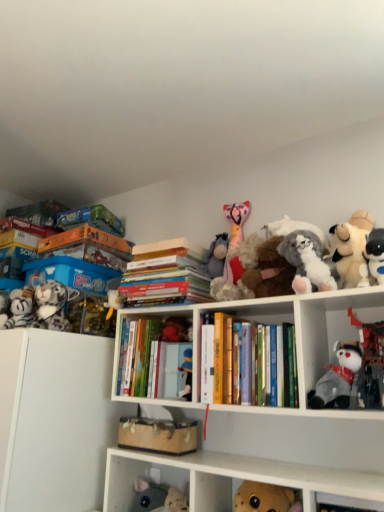
Locate an element on the screen. fuzzy fabric stuffed animal at lower left, the 1th cabinet from the bottom is located at coordinates (138, 476).

What do you see at coordinates (54, 420) in the screenshot? This screenshot has width=384, height=512. I see `white matte cabinet at left` at bounding box center [54, 420].

Describe the element at coordinates (267, 326) in the screenshot. I see `white matte bookshelf at upper center, placed as the 2th cabinet when sorted from bottom to top` at that location.

The width and height of the screenshot is (384, 512). What do you see at coordinates (373, 259) in the screenshot? I see `white plush toy at upper right, which ranks as the 9th toy in left-to-right order` at bounding box center [373, 259].

The width and height of the screenshot is (384, 512). Find the location of `hardcover books at center, the 1th book positioned from the right`. hardcover books at center, the 1th book positioned from the right is located at coordinates (249, 362).

Image resolution: width=384 pixels, height=512 pixels. Find the location of `striped plush tiger at left, which appears as the tenth toy when viewed from the right`. striped plush tiger at left, which appears as the tenth toy when viewed from the right is located at coordinates (19, 309).

From the image's perspective, which is above, gray plush toy at center-right, placed as the fourth toy when sorted from right to left, or white plush toy at upper right, which is the 2th toy in right-to-left order?

From the image's view, white plush toy at upper right, which is the 2th toy in right-to-left order, is above.

Starting from the white plush toy at upper right, which ranks as the 9th toy in left-to-right order, which toy is the 2nd one to the left? Please provide its 2D coordinates.

[(337, 378)]

Is gray plush toy at center-right, placed as the fourth toy when sorted from right to left, taller than white plush toy at upper right, which is the 2th toy in right-to-left order?

Yes, gray plush toy at center-right, placed as the fourth toy when sorted from right to left, is taller than white plush toy at upper right, which is the 2th toy in right-to-left order.

Considering the positions of point (361, 279) and point (315, 257), is point (361, 279) closer or farther from the camera than point (315, 257)?

Point (361, 279).

Between white plush toy at upper right, which is the 2th toy in right-to-left order, and fluffy white plush at upper right, the 6th toy in the left-to-right sequence, which one appears on the left side from the viewer's perspective?

From the viewer's perspective, fluffy white plush at upper right, the 6th toy in the left-to-right sequence, appears more on the left side.

From the image's perspective, is white plush toy at upper right, which is the 2th toy in right-to-left order, located beneath fluffy white plush at upper right, placed as the 5th toy when sorted from right to left?

No, from the image's perspective, white plush toy at upper right, which is the 2th toy in right-to-left order, is not beneath fluffy white plush at upper right, placed as the 5th toy when sorted from right to left.

Is white plush toy at upper right, which is the 2th toy in right-to-left order, positioned beyond the bounds of fluffy white plush at upper right, placed as the 5th toy when sorted from right to left?

Absolutely, white plush toy at upper right, which is the 2th toy in right-to-left order, is external to fluffy white plush at upper right, placed as the 5th toy when sorted from right to left.

Is white matte bookshelf at upper center, placed as the 2th cabinet when sorted from bottom to top, shorter than hardcover books at center, the 3th book positioned from the left?

No, white matte bookshelf at upper center, placed as the 2th cabinet when sorted from bottom to top, is not shorter than hardcover books at center, the 3th book positioned from the left.

In the scene shown: Can you confirm if white matte bookshelf at upper center, placed as the 2th cabinet when sorted from bottom to top, is thinner than hardcover books at center, the 1th book positioned from the right?

No, white matte bookshelf at upper center, placed as the 2th cabinet when sorted from bottom to top, is not thinner than hardcover books at center, the 1th book positioned from the right.

From a real-world perspective, relative to hardcover books at center, the 1th book positioned from the right, is white matte bookshelf at upper center, placed as the 2th cabinet when sorted from bottom to top, vertically above or below?

From a real-world perspective, white matte bookshelf at upper center, placed as the 2th cabinet when sorted from bottom to top, is physically above hardcover books at center, the 1th book positioned from the right.

Is white matte bookshelf at upper center, the 1th cabinet positioned from the top, outside of hardcover books at center, the 1th book positioned from the right?

white matte bookshelf at upper center, the 1th cabinet positioned from the top, is positioned outside hardcover books at center, the 1th book positioned from the right.

Is point (360, 230) positioned before point (137, 331)?

Yes.

Does fluffy white stuffed animal at upper right, which is the 3th toy from right to left, contain white matte bookshelf at upper center, the 1th cabinet positioned from the top?

No, white matte bookshelf at upper center, the 1th cabinet positioned from the top, is not a part of fluffy white stuffed animal at upper right, which is the 3th toy from right to left.

Considering their positions, is fluffy white stuffed animal at upper right, which ranks as the eighth toy in left-to-right order, located in front of or behind white matte bookshelf at upper center, the 1th cabinet positioned from the top?

fluffy white stuffed animal at upper right, which ranks as the eighth toy in left-to-right order, is positioned farther from the viewer than white matte bookshelf at upper center, the 1th cabinet positioned from the top.

Is fluffy white stuffed animal at upper right, which is the 3th toy from right to left, next to white matte bookshelf at upper center, placed as the 2th cabinet when sorted from bottom to top, and touching it?

No, fluffy white stuffed animal at upper right, which is the 3th toy from right to left, is not making contact with white matte bookshelf at upper center, placed as the 2th cabinet when sorted from bottom to top.

From a real-world perspective, relative to hardcover books at center, placed as the first book when sorted from left to right, is velvet plush bear at center, which ranks as the third toy in left-to-right order, vertically above or below?

velvet plush bear at center, which ranks as the third toy in left-to-right order, is above hardcover books at center, placed as the first book when sorted from left to right.

Is velvet plush bear at center, the 8th toy positioned from the right, further to camera compared to hardcover books at center, placed as the first book when sorted from left to right?

Yes, velvet plush bear at center, the 8th toy positioned from the right, is further from the camera.

Does velvet plush bear at center, which ranks as the third toy in left-to-right order, have a greater height compared to hardcover books at center, placed as the first book when sorted from left to right?

No.

Are velvet plush bear at center, which ranks as the third toy in left-to-right order, and hardcover books at center, placed as the first book when sorted from left to right, beside each other?

Yes, velvet plush bear at center, which ranks as the third toy in left-to-right order, is with hardcover books at center, placed as the first book when sorted from left to right.

From the image's perspective, which is below, fluffy white plush at upper right, the 6th toy in the left-to-right sequence, or fluffy pink plush at upper center, marked as the fifth toy in a left-to-right arrangement?

From the image's view, fluffy white plush at upper right, the 6th toy in the left-to-right sequence, is below.

Which of these two, fluffy white plush at upper right, the 6th toy in the left-to-right sequence, or fluffy pink plush at upper center, which appears as the sixth toy when viewed from the right, is smaller?

Smaller between the two is fluffy pink plush at upper center, which appears as the sixth toy when viewed from the right.

Locate an element on the screen. The width and height of the screenshot is (384, 512). the 4th toy in front of the fluffy pink plush at upper center, marked as the fifth toy in a left-to-right arrangement, starting your count from the anchor is located at coordinates (308, 262).

Can you confirm if fluffy white plush at upper right, the 6th toy in the left-to-right sequence, is thinner than fluffy pink plush at upper center, marked as the fifth toy in a left-to-right arrangement?

Incorrect, the width of fluffy white plush at upper right, the 6th toy in the left-to-right sequence, is not less than that of fluffy pink plush at upper center, marked as the fifth toy in a left-to-right arrangement.

Which of these two, velvet plush bear at center, which ranks as the third toy in left-to-right order, or matte plastic toy at center, marked as the 4th toy in a left-to-right arrangement, is bigger?

With larger size is velvet plush bear at center, which ranks as the third toy in left-to-right order.

Which of these two, velvet plush bear at center, the 8th toy positioned from the right, or matte plastic toy at center, marked as the 4th toy in a left-to-right arrangement, stands shorter?

velvet plush bear at center, the 8th toy positioned from the right, is shorter.

Consider the image. Considering the sizes of velvet plush bear at center, the 8th toy positioned from the right, and matte plastic toy at center, the 7th toy when ordered from right to left, in the image, is velvet plush bear at center, the 8th toy positioned from the right, wider or thinner than matte plastic toy at center, the 7th toy when ordered from right to left,?

In the image, velvet plush bear at center, the 8th toy positioned from the right, appears to be wider than matte plastic toy at center, the 7th toy when ordered from right to left.

Locate an element on the screen. The height and width of the screenshot is (512, 384). the 6th toy above the gray plush toy at center-right, which is the seventh toy from left to right (from the image's perspective) is located at coordinates (373, 259).

From the fluffy white plush at upper right, the 6th toy in the left-to-right sequence, count 2nd toys forward and point to it. Please provide its 2D coordinates.

[(373, 259)]

Which object lies further to the anchor point fluffy white stuffed animal at upper right, which ranks as the eighth toy in left-to-right order, white matte cabinet at left or fluffy gray plush at left, placed as the 9th toy when sorted from right to left?

The object further to fluffy white stuffed animal at upper right, which ranks as the eighth toy in left-to-right order, is white matte cabinet at left.

When comparing their distances from white plush toy at right, the first toy when ordered from right to left, does hardcover books at center, the 1th book positioned from the right, or velvet plush bear at center, the 8th toy positioned from the right, seem further?

Based on the image, velvet plush bear at center, the 8th toy positioned from the right, appears to be further to white plush toy at right, the first toy when ordered from right to left.

From the picture: When comparing their distances from fuzzy fabric stuffed animal at lower left, placed as the 2th cabinet when sorted from top to bottom, does hardcover books at center, the 1th book positioned from the right, or white matte bookshelf at upper center, placed as the 2th cabinet when sorted from bottom to top, seem closer?

white matte bookshelf at upper center, placed as the 2th cabinet when sorted from bottom to top, is positioned closer to the anchor fuzzy fabric stuffed animal at lower left, placed as the 2th cabinet when sorted from top to bottom.

From the image, which object appears to be nearer to hardcover books at center, the 3th book positioned from the left, fluffy gray plush at left, the 2th toy in the left-to-right sequence, or hardcover books at center, placed as the 2th book when sorted from left to right?

hardcover books at center, placed as the 2th book when sorted from left to right, lies closer to hardcover books at center, the 3th book positioned from the left, than the other object.

From the image, which object appears to be farther from white plush toy at right, acting as the tenth toy starting from the left, fluffy gray plush at left, the 2th toy in the left-to-right sequence, or matte plastic toy at center, marked as the 4th toy in a left-to-right arrangement?

fluffy gray plush at left, the 2th toy in the left-to-right sequence.

Based on their spatial positions, is striped plush tiger at left, which appears as the tenth toy when viewed from the right, or hardcover books at center, the 3th book positioned from the left, further from hardcover books at center, placed as the first book when sorted from left to right?

striped plush tiger at left, which appears as the tenth toy when viewed from the right, lies further to hardcover books at center, placed as the first book when sorted from left to right, than the other object.

Based on their spatial positions, is white matte bookshelf at upper center, placed as the 2th cabinet when sorted from bottom to top, or fluffy white plush at upper right, the 6th toy in the left-to-right sequence, further from gray plush toy at center-right, placed as the fourth toy when sorted from right to left?

fluffy white plush at upper right, the 6th toy in the left-to-right sequence, is further to gray plush toy at center-right, placed as the fourth toy when sorted from right to left.

Looking at the image, which one is located closer to fluffy white stuffed animal at upper right, which ranks as the eighth toy in left-to-right order, white matte bookshelf at upper center, placed as the 2th cabinet when sorted from bottom to top, or velvet plush bear at center, the 8th toy positioned from the right?

Based on the image, white matte bookshelf at upper center, placed as the 2th cabinet when sorted from bottom to top, appears to be nearer to fluffy white stuffed animal at upper right, which ranks as the eighth toy in left-to-right order.

Find the location of a particular element. The width and height of the screenshot is (384, 512). book between velvet plush bear at center, which ranks as the third toy in left-to-right order, and fluffy white plush at upper right, placed as the 5th toy when sorted from right to left, in the horizontal direction is located at coordinates (249, 362).

Identify the location of cabinet between hardcover books at center, the second book viewed from the right, and fluffy white plush at upper right, placed as the 5th toy when sorted from right to left, in the horizontal direction. The image size is (384, 512). (267, 326).

This screenshot has width=384, height=512. I want to click on book located between striped plush tiger at left, which appears as the tenth toy when viewed from the right, and hardcover books at center, the second book viewed from the right, in the left-right direction, so click(x=152, y=362).

You are a GUI agent. You are given a task and a screenshot of the screen. Output one action in this format:
    pyautogui.click(x=<x>, y=<y>)
    Task: Click on the toy between hardcover books at center, the 1th book positioned from the right, and fuzzy fabric stuffed animal at lower left, the 1th cabinet from the bottom, vertically
    The image size is (384, 512).
    Given the screenshot: What is the action you would take?
    pyautogui.click(x=186, y=373)